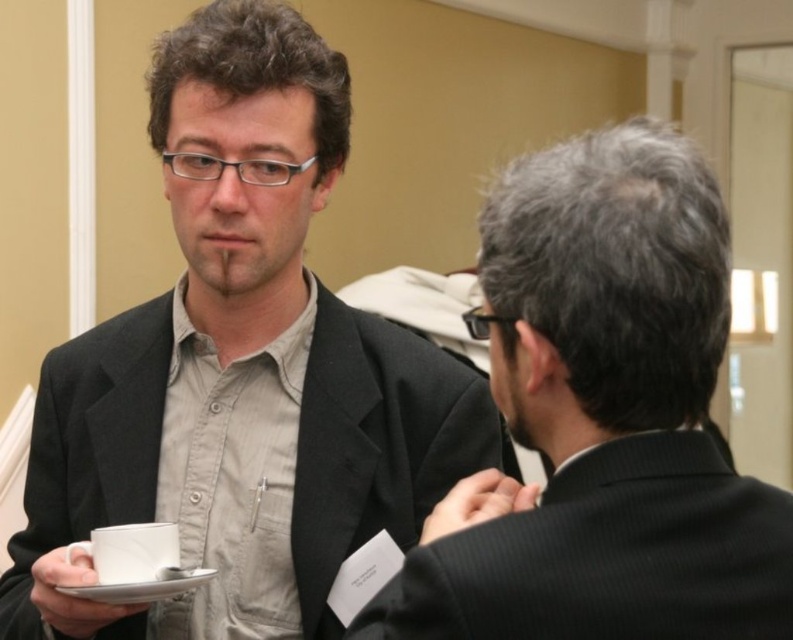
You are a photographer at the event and need to capture a photo that includes both the black pinstripe suit at right and the white ceramic cup at lower left. Since the cup is smaller, will you need to adjust your camera angle to ensure both are visible in the frame?

The black pinstripe suit at right is taller than the white ceramic cup at lower left, so you may need to adjust your camera angle to ensure both are visible in the frame.

Based on the photo, you are a photographer setting up for a formal event. You need to ensure that the matte black suit at center and the white ceramic saucer at lower left are both visible in your shot. Based on their sizes, which object should you prioritize framing closer to the camera to maintain their visibility?

The matte black suit at center is taller than the white ceramic saucer at lower left, so you should prioritize framing the white ceramic saucer at lower left closer to the camera to ensure both are visible. Wait, that seems contradictory. Let me think again. If the suit is taller, it might already be more visible. To keep both visible, maybe frame the saucer closer so it appears larger. Hmm, perhaps the answer should state that since the suit is taller, it will naturally be more prominent, so the saucer can

You are a photographer at a formal event. You need to take a photo of the black pinstripe suit at right and the white ceramic saucer at lower left. Based on their positions, which object is located more to the right side of the image?

The black pinstripe suit at right is to the right of the white ceramic saucer at lower left, so the black pinstripe suit at right is more to the right side of the image.